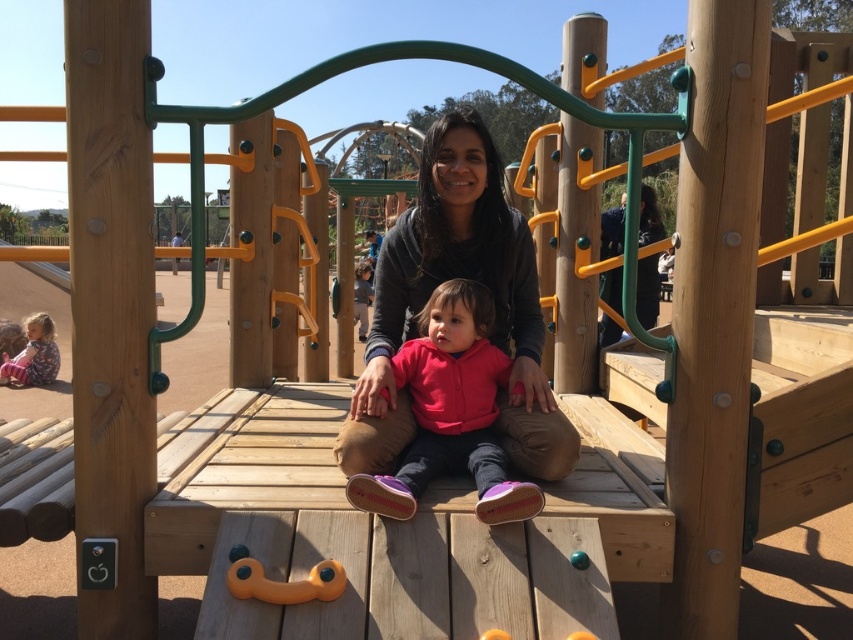
You are a photographer trying to capture a photo of the matte black hoodie at center and the matte pink jacket at lower left. You want to ensure both subjects are fully visible in the frame. Based on their positions and sizes, is there any concern about one blocking the other?

The matte black hoodie at center might be wider than the matte pink jacket at lower left, so there could be a possibility that the matte black hoodie at center partially obscures the matte pink jacket at lower left depending on their exact positioning.

Consider the image. You are a photographer trying to capture a photo of the matte black hoodie at center and the pink fleece jacket at center. Since you want both to be clearly visible, which one should you focus on first to ensure proper focus, considering their sizes?

The matte black hoodie at center is bigger than the pink fleece jacket at center, so you should focus on the matte black hoodie at center first to ensure it is in focus, then the smaller pink fleece jacket at center will also be in focus if they are at the same distance.

You are designing a new bench for the playground that needs to accommodate both the matte black hoodie at center and the pink fleece jacket at center. Based on their widths, which one requires more space on the bench?

The matte black hoodie at center might require more space on the bench since it might be wider than the pink fleece jacket at center.